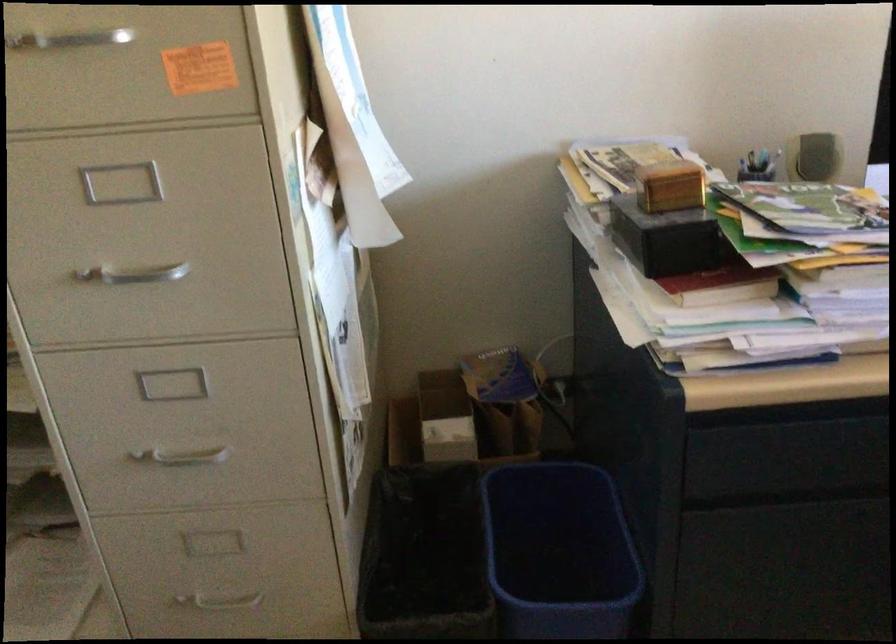
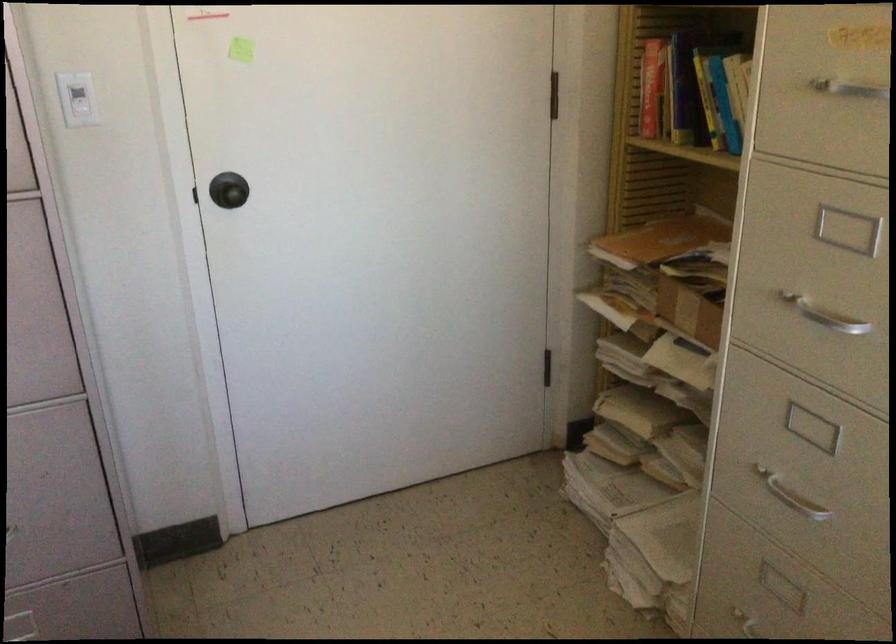
Locate, in the second image, the point that corresponds to (138,263) in the first image.

(824, 315)